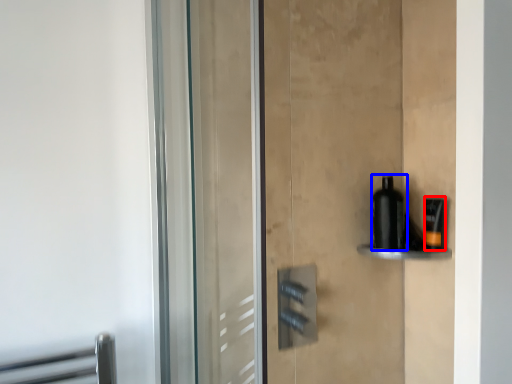
Question: Which point is further to the camera, toiletry (highlighted by a red box) or bottle (highlighted by a blue box)?

Choices:
 (A) toiletry
 (B) bottle

Answer: (B)